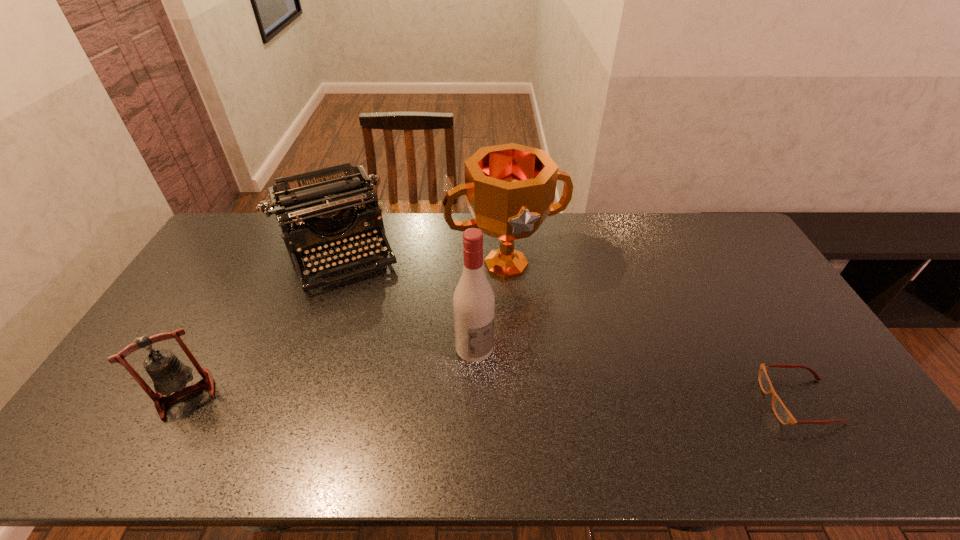
I want to click on award that is at the far edge, so click(510, 189).

This screenshot has width=960, height=540. Find the location of `bell located in the near edge section of the desktop`. bell located in the near edge section of the desktop is located at coordinates (168, 373).

Where is `spectacles at the near edge`? spectacles at the near edge is located at coordinates (782, 413).

Find the location of `object at the left edge`. object at the left edge is located at coordinates (168, 373).

This screenshot has width=960, height=540. In order to click on object present at the right edge in this screenshot , I will do `click(782, 413)`.

You are a GUI agent. You are given a task and a screenshot of the screen. Output one action in this format:
    pyautogui.click(x=<x>, y=<y>)
    Task: Click on the object positioned at the near left corner
    The width and height of the screenshot is (960, 540).
    Given the screenshot: What is the action you would take?
    pyautogui.click(x=168, y=373)

Find the location of a particular element. object present at the near right corner is located at coordinates (782, 413).

Identify the location of free space at the far edge of the desktop. (396, 222).

This screenshot has width=960, height=540. I want to click on vacant point at the near edge, so click(x=694, y=405).

The image size is (960, 540). In order to click on vacant area at the near right corner in this screenshot , I will do `click(808, 401)`.